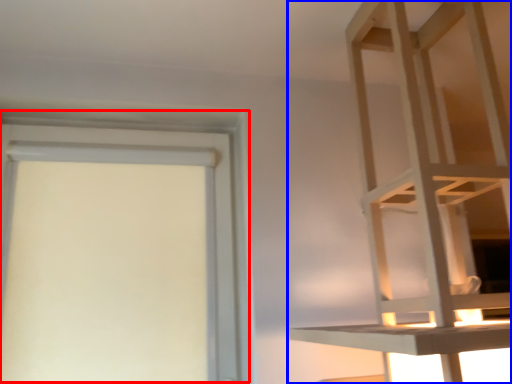
Question: Which object is further to the camera taking this photo, bay window (highlighted by a red box) or furniture (highlighted by a blue box)?

Choices:
 (A) bay window
 (B) furniture

Answer: (A)